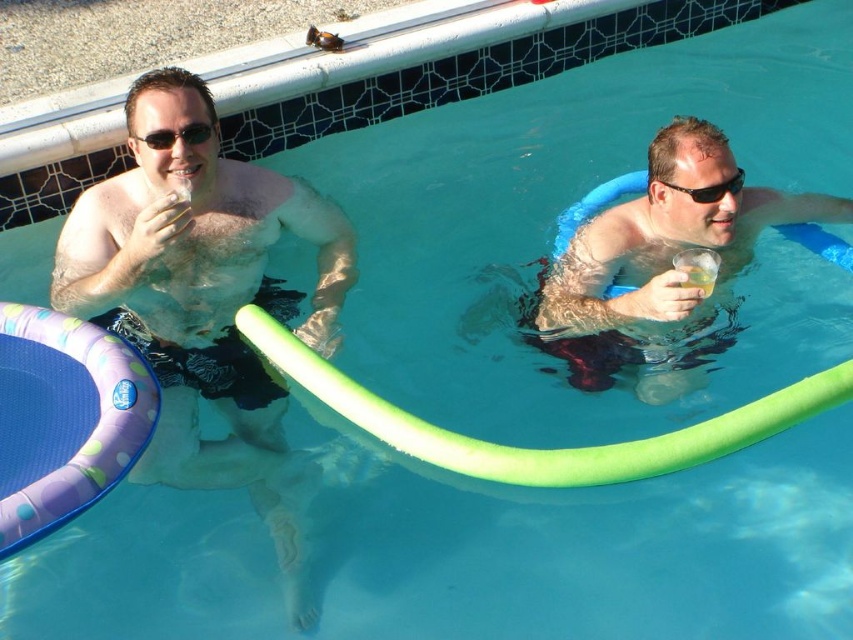
Is matte black shorts at left further to camera compared to matte blue float at right?

Yes, it is behind matte blue float at right.

In the scene shown: Who is more forward, (218, 292) or (596, 230)?

Point (596, 230)

Find the location of `matte black shorts at left`. matte black shorts at left is located at coordinates (204, 298).

You are a GUI agent. You are given a task and a screenshot of the screen. Output one action in this format:
    pyautogui.click(x=<x>, y=<y>)
    Task: Click on the matte black shorts at left
    
    Given the screenshot: What is the action you would take?
    tap(204, 298)

Who is more distant from viewer, (160, 474) or (195, 136)?

The point (195, 136) is more distant.

In the scene shown: Who is higher up, matte black shorts at left or matte black sunglasses at upper left?

Positioned higher is matte black sunglasses at upper left.

Measure the distance between matte black shorts at left and camera.

matte black shorts at left and camera are 8.23 feet apart.

You are a GUI agent. You are given a task and a screenshot of the screen. Output one action in this format:
    pyautogui.click(x=<x>, y=<y>)
    Task: Click on the matte black shorts at left
    The image size is (853, 640).
    Given the screenshot: What is the action you would take?
    pyautogui.click(x=204, y=298)

Does matte blue float at right have a lesser width compared to black plastic goggles at upper right?

Incorrect, matte blue float at right's width is not less than black plastic goggles at upper right's.

Is matte blue float at right to the right of black plastic goggles at upper right from the viewer's perspective?

Yes, matte blue float at right is to the right of black plastic goggles at upper right.

This screenshot has height=640, width=853. I want to click on matte blue float at right, so click(660, 268).